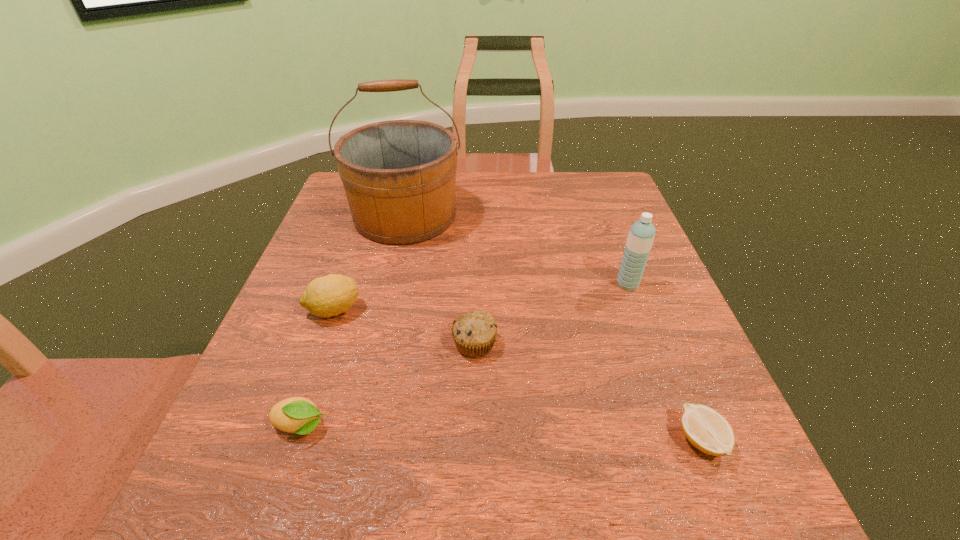
Choose which lemon is the third nearest neighbor to the bucket. Please provide its 2D coordinates. Your answer should be formatted as a tuple, i.e. [(x, y)], where the tuple contains the x and y coordinates of a point satisfying the conditions above.

[(707, 430)]

I want to click on free spot that satisfies the following two spatial constraints: 1. on the front side of the tallest object; 2. on the left side of the fifth shortest object, so click(389, 285).

The width and height of the screenshot is (960, 540). Find the location of `blank space that satisfies the following two spatial constraints: 1. with leaves positioned above the second shortest object; 2. on the right side of the rightmost lemon`. blank space that satisfies the following two spatial constraints: 1. with leaves positioned above the second shortest object; 2. on the right side of the rightmost lemon is located at coordinates (296, 441).

I want to click on vacant position in the image that satisfies the following two spatial constraints: 1. on the back side of the shortest object; 2. at the stem end of the fourth nearest object, so click(648, 310).